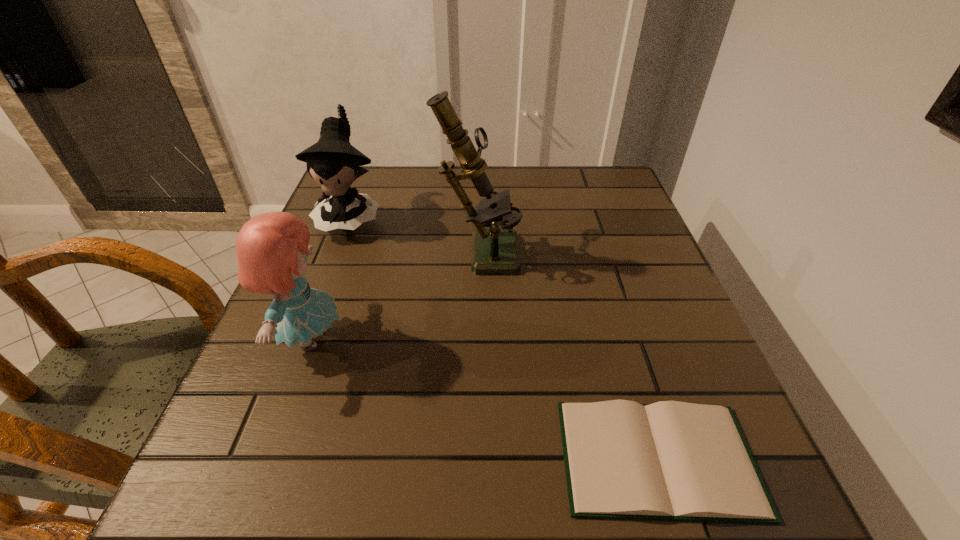
Locate an element on the screen. vacant region that satisfies the following two spatial constraints: 1. at the face of the farther doll; 2. on the right side of the nearest object is located at coordinates (258, 458).